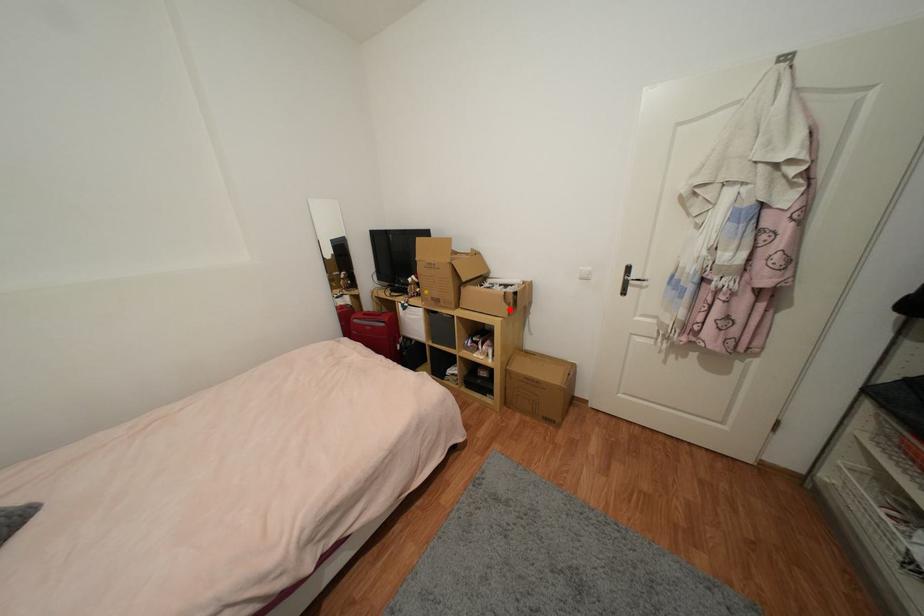
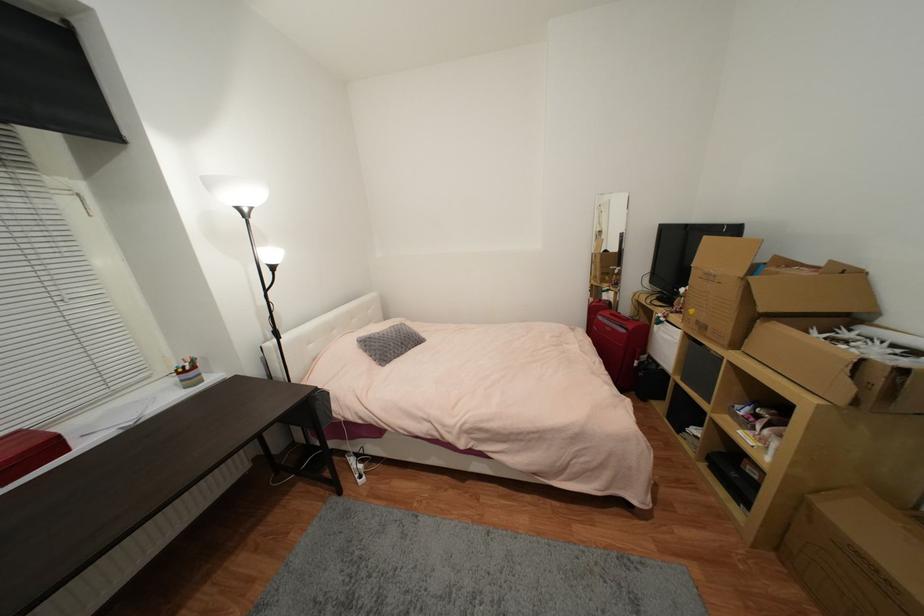
Locate, in the second image, the point that corresponds to the highlighted location in the first image.

(852, 390)